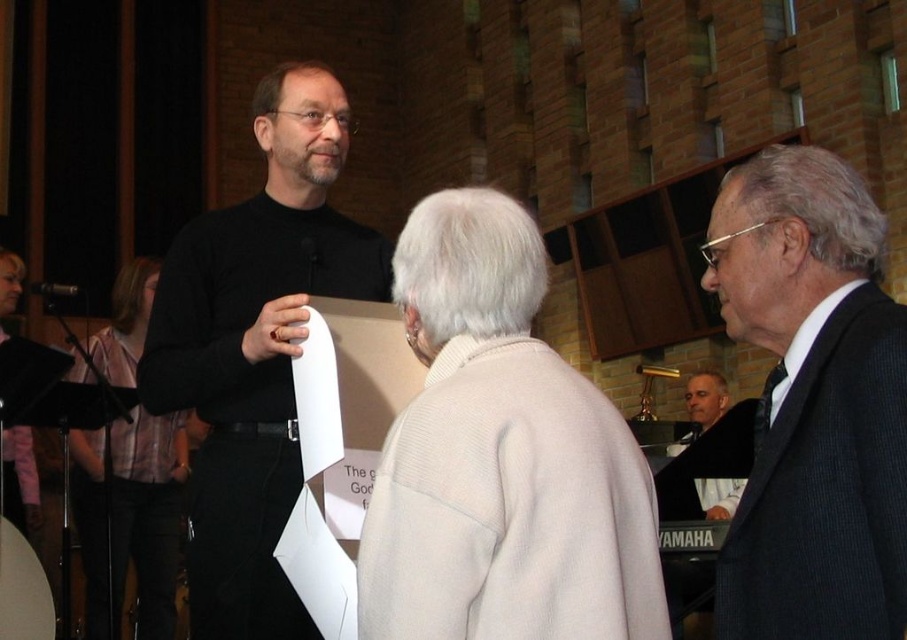
You are organizing a photo shoot and need to arrange two outfits on a mannequin stand. The stand can only hold items with a combined width of 1.2 meters. You have the white woolen sweater at center and the dark gray suit at right. Knowing their individual widths, can both outfits fit on the stand together?

The white woolen sweater at center is wider than the dark gray suit at right. However, since the exact widths are not provided, we cannot determine if their combined width exceeds 1.2 meters. Please check the specific measurements.

You are an event planner arranging seating for the ceremony. You need to place a nameplate for the dark gray suit at right and the black matte sweater at center. According to their positions in the image, where should each nameplate be placed relative to the other?

The dark gray suit at right should be placed below the black matte sweater at center because the dark gray suit at right is located below black matte sweater at center in the image.

Looking at this image, you are an event planner organizing seating arrangements for the ceremony. You need to seat the dark gray suit at right and the black matte sweater at center such that the taller person sits in the front row. Based on the image, which individual should be seated in the front row?

The black matte sweater at center should be seated in the front row because the dark gray suit at right is not as tall as the black matte sweater at center, indicating the latter is taller.